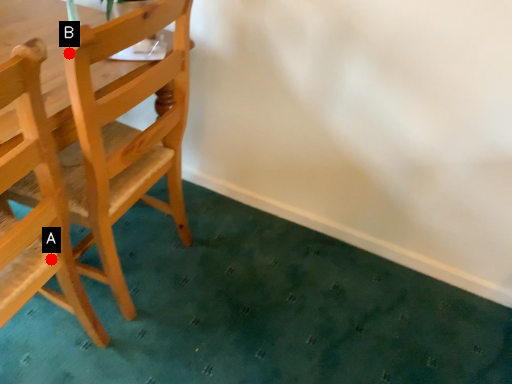
Question: Two points are circled on the image, labeled by A and B beside each circle. Which point is closer to the camera?

Choices:
 (A) A is closer
 (B) B is closer

Answer: (B)